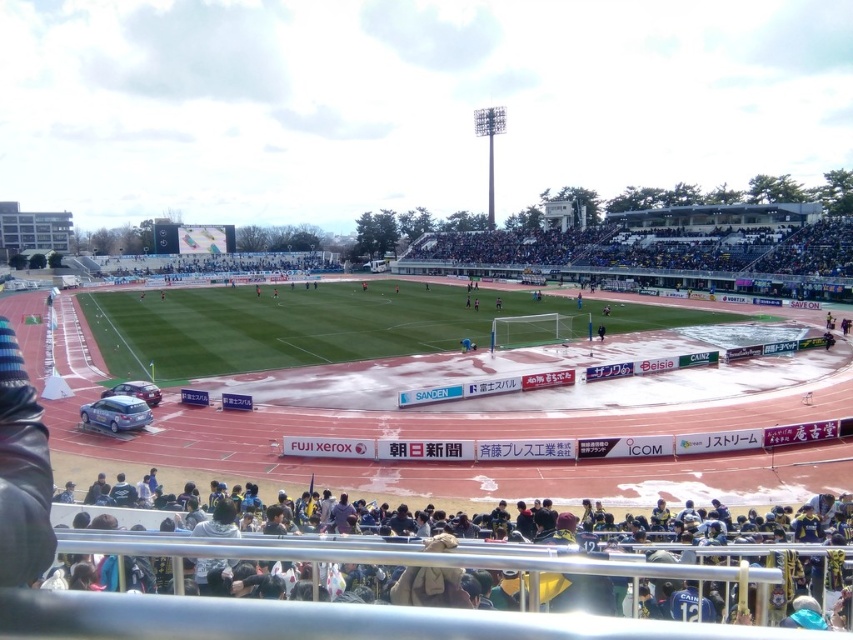
Question: Which point is farther to the camera?

Choices:
 (A) (144, 388)
 (B) (114, 410)

Answer: (A)

Question: Where is dark blue fabric at lower center located in relation to satin silver car at lower left in the image?

Choices:
 (A) left
 (B) right

Answer: (B)

Question: Which of the following is the farthest from the observer?

Choices:
 (A) satin blue sedan at lower left
 (B) dark blue fabric at lower center
 (C) satin silver car at lower left

Answer: (C)

Question: Where is dark blue fabric at lower center located in relation to satin silver car at lower left in the image?

Choices:
 (A) right
 (B) left

Answer: (A)

Question: Which of the following is the farthest from the observer?

Choices:
 (A) satin blue sedan at lower left
 (B) dark blue fabric at lower center
 (C) satin silver car at lower left

Answer: (C)

Question: Does satin blue sedan at lower left appear under satin silver car at lower left?

Choices:
 (A) yes
 (B) no

Answer: (A)